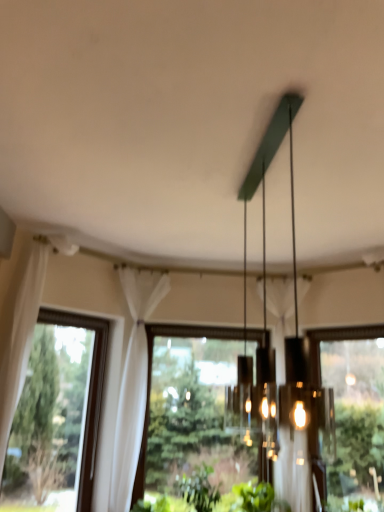
Question: Relative to transparent glass window at right, which appears as the 3th window when viewed from the left, is matte green chandelier at center in front or behind?

Choices:
 (A) front
 (B) behind

Answer: (A)

Question: Considering the positions of point (251, 163) and point (327, 501), is point (251, 163) closer or farther from the camera than point (327, 501)?

Choices:
 (A) closer
 (B) farther

Answer: (A)

Question: Which of these objects is positioned farthest from the white sheer curtain at left?

Choices:
 (A) transparent glass window at right, placed as the first window when sorted from right to left
 (B) transparent glass window at center, positioned as the 2th window in left-to-right order
 (C) matte green chandelier at center
 (D) green leafy plant at lower center
 (E) clear glass window at left, which appears as the 3th window when viewed from the right

Answer: (C)

Question: Considering the real-world distances, which object is farthest from the white sheer curtain at left?

Choices:
 (A) clear glass window at left, which appears as the 1th window when viewed from the left
 (B) transparent glass window at center, positioned as the second window in right-to-left order
 (C) matte green chandelier at center
 (D) green leafy plant at lower center
 (E) transparent glass window at right, which appears as the 3th window when viewed from the left

Answer: (C)